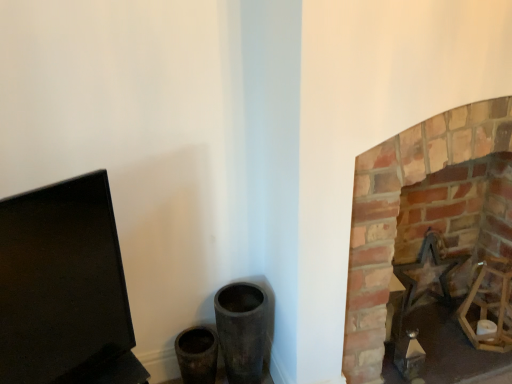
Question: Are black matte computer monitor at left and brick fireplace at right making contact?

Choices:
 (A) yes
 (B) no

Answer: (B)

Question: Is black matte computer monitor at left not inside brick fireplace at right?

Choices:
 (A) yes
 (B) no

Answer: (A)

Question: Considering the relative positions of black matte computer monitor at left and brick fireplace at right in the image provided, is black matte computer monitor at left in front of brick fireplace at right?

Choices:
 (A) yes
 (B) no

Answer: (A)

Question: Considering the relative sizes of black matte computer monitor at left and brick fireplace at right in the image provided, is black matte computer monitor at left bigger than brick fireplace at right?

Choices:
 (A) no
 (B) yes

Answer: (A)

Question: Does black matte computer monitor at left turn towards brick fireplace at right?

Choices:
 (A) no
 (B) yes

Answer: (A)

Question: Is metallic star at right inside the boundaries of black matte computer monitor at left, or outside?

Choices:
 (A) inside
 (B) outside

Answer: (B)

Question: Looking at their shapes, would you say metallic star at right is wider or thinner than black matte computer monitor at left?

Choices:
 (A) thin
 (B) wide

Answer: (A)

Question: Is metallic star at right bigger or smaller than black matte computer monitor at left?

Choices:
 (A) big
 (B) small

Answer: (B)

Question: From a real-world perspective, is metallic star at right above or below black matte computer monitor at left?

Choices:
 (A) below
 (B) above

Answer: (A)

Question: From the image's perspective, is black matte computer monitor at left above or below metallic star at right?

Choices:
 (A) below
 (B) above

Answer: (B)

Question: Is black matte computer monitor at left inside or outside of metallic star at right?

Choices:
 (A) outside
 (B) inside

Answer: (A)

Question: In the image, is black matte computer monitor at left positioned in front of or behind metallic star at right?

Choices:
 (A) behind
 (B) front

Answer: (B)

Question: Considering the positions of black matte computer monitor at left and metallic star at right in the image, is black matte computer monitor at left wider or thinner than metallic star at right?

Choices:
 (A) thin
 (B) wide

Answer: (B)

Question: Looking at their shapes, would you say black matte computer monitor at left is wider or thinner than brick fireplace at right?

Choices:
 (A) wide
 (B) thin

Answer: (B)

Question: Considering the relative positions of black matte computer monitor at left and brick fireplace at right in the image provided, is black matte computer monitor at left to the left or to the right of brick fireplace at right?

Choices:
 (A) right
 (B) left

Answer: (B)